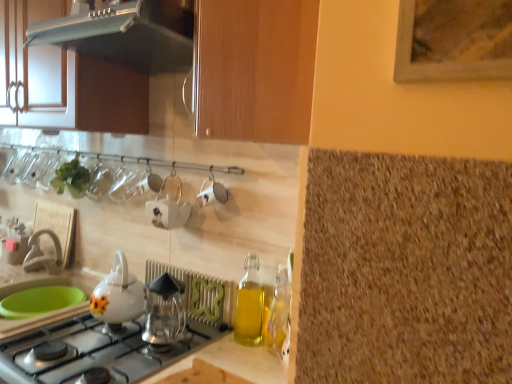
At what (x,y) coordinates should I click in order to perform the action: click on white glossy teapot at lower left, the second kitchen appliance viewed from the top. Please return your answer as a coordinate pair (x, y). Looking at the image, I should click on (117, 297).

Consider the image. Measure the distance between translucent glass bottle at right and camera.

1.17 meters.

Measure the distance between point (273, 320) and camera.

Point (273, 320) is 4.65 feet from camera.

Describe the element at coordinates (97, 352) in the screenshot. This screenshot has width=512, height=384. I see `white glossy gas stove at lower left` at that location.

The image size is (512, 384). What do you see at coordinates (211, 192) in the screenshot?
I see `white ceramic cup at center, the first tableware positioned from the front` at bounding box center [211, 192].

Find the location of a particular element. The height and width of the screenshot is (384, 512). clear glass vase at upper left, the second tableware viewed from the right is located at coordinates (48, 170).

At what (x,y) coordinates should I click in order to perform the action: click on white glossy teapot at lower left, which is the 2th kitchen appliance in bottom-to-top order. Please return your answer as a coordinate pair (x, y). This screenshot has height=384, width=512. Looking at the image, I should click on (117, 297).

Is white ceramic teapot at center oriented towards white glossy gas stove at lower left?

No, white ceramic teapot at center is not aimed at white glossy gas stove at lower left.

Consider the image. From the image's perspective, which object appears higher, white ceramic teapot at center or white glossy gas stove at lower left?

From the image's view, white ceramic teapot at center is above.

From a real-world perspective, who is located higher, white ceramic teapot at center or white glossy gas stove at lower left?

white ceramic teapot at center is physically above.

Between white ceramic teapot at center and white glossy gas stove at lower left, which one appears on the right side from the viewer's perspective?

white ceramic teapot at center.

Based on the photo, considering the relative sizes of clear glass vase at upper left, arranged as the 1th tableware when viewed from the back, and white ceramic teapot at center in the image provided, is clear glass vase at upper left, arranged as the 1th tableware when viewed from the back, thinner than white ceramic teapot at center?

Indeed, clear glass vase at upper left, arranged as the 1th tableware when viewed from the back, has a lesser width compared to white ceramic teapot at center.

Is clear glass vase at upper left, the second tableware viewed from the right, looking in the opposite direction of white ceramic teapot at center?

No, clear glass vase at upper left, the second tableware viewed from the right, is not facing away from white ceramic teapot at center.

Identify the location of appliance directly beneath the clear glass vase at upper left, arranged as the 1th tableware when viewed from the back (from a real-world perspective). (169, 205).

There is a white glossy teapot at lower left, which is the 2th kitchen appliance in bottom-to-top order. Where is `kitchen appliance above it (from a real-world perspective)`? Image resolution: width=512 pixels, height=384 pixels. kitchen appliance above it (from a real-world perspective) is located at coordinates (127, 34).

How different are the orientations of satin silver range hood at upper left, the third kitchen appliance in the bottom-to-top sequence, and white glossy teapot at lower left, the second kitchen appliance viewed from the top, in degrees?

There is a 0.186-degree angle between the facing directions of satin silver range hood at upper left, the third kitchen appliance in the bottom-to-top sequence, and white glossy teapot at lower left, the second kitchen appliance viewed from the top.

In the image, is satin silver range hood at upper left, the third kitchen appliance in the bottom-to-top sequence, on the left side or the right side of white glossy teapot at lower left, which is the 2th kitchen appliance in bottom-to-top order?

satin silver range hood at upper left, the third kitchen appliance in the bottom-to-top sequence, is positioned on white glossy teapot at lower left, which is the 2th kitchen appliance in bottom-to-top order,'s right side.

From the image's perspective, does satin silver range hood at upper left, which appears as the 1th kitchen appliance when viewed from the top, appear lower than white glossy teapot at lower left, which is the 2th kitchen appliance in bottom-to-top order?

No.

Is translucent glass bottle at right positioned with its back to satin silver range hood at upper left, the third kitchen appliance in the bottom-to-top sequence?

That's not correct — translucent glass bottle at right is not looking away from satin silver range hood at upper left, the third kitchen appliance in the bottom-to-top sequence.

Based on the photo, can you confirm if translucent glass bottle at right is smaller than satin silver range hood at upper left, which appears as the 1th kitchen appliance when viewed from the top?

Yes.

Is translucent glass bottle at right completely or partially outside of satin silver range hood at upper left, which appears as the 1th kitchen appliance when viewed from the top?

translucent glass bottle at right is positioned outside satin silver range hood at upper left, which appears as the 1th kitchen appliance when viewed from the top.

Does point (274, 309) come closer to viewer compared to point (175, 53)?

No, (274, 309) is behind (175, 53).

From a real-world perspective, is satin silver range hood at upper left, which appears as the 1th kitchen appliance when viewed from the top, positioned above or below clear glass vase at upper left, the 1th tableware positioned from the left?

In terms of real-world spatial position, satin silver range hood at upper left, which appears as the 1th kitchen appliance when viewed from the top, is above clear glass vase at upper left, the 1th tableware positioned from the left.

Considering the sizes of satin silver range hood at upper left, the third kitchen appliance in the bottom-to-top sequence, and clear glass vase at upper left, the 1th tableware positioned from the left, in the image, is satin silver range hood at upper left, the third kitchen appliance in the bottom-to-top sequence, taller or shorter than clear glass vase at upper left, the 1th tableware positioned from the left,?

satin silver range hood at upper left, the third kitchen appliance in the bottom-to-top sequence, is shorter than clear glass vase at upper left, the 1th tableware positioned from the left.

From the picture: From the image's perspective, would you say satin silver range hood at upper left, which appears as the 1th kitchen appliance when viewed from the top, is shown under clear glass vase at upper left, the 1th tableware positioned from the left?

Incorrect, from the image's perspective, satin silver range hood at upper left, which appears as the 1th kitchen appliance when viewed from the top, is higher than clear glass vase at upper left, the 1th tableware positioned from the left.

Can you tell me how much satin silver range hood at upper left, which appears as the 1th kitchen appliance when viewed from the top, and clear glass vase at upper left, arranged as the 1th tableware when viewed from the back, differ in facing direction?

The angular difference between satin silver range hood at upper left, which appears as the 1th kitchen appliance when viewed from the top, and clear glass vase at upper left, arranged as the 1th tableware when viewed from the back, is 1.76 degrees.

Is transparent glass coffee maker at center, the 3th kitchen appliance in the top-to-bottom sequence, thinner than clear glass vase at upper left, arranged as the 1th tableware when viewed from the back?

Incorrect, the width of transparent glass coffee maker at center, the 3th kitchen appliance in the top-to-bottom sequence, is not less than that of clear glass vase at upper left, arranged as the 1th tableware when viewed from the back.

Does point (155, 325) come closer to viewer compared to point (42, 178)?

That is True.

Who is smaller, transparent glass coffee maker at center, the 3th kitchen appliance in the top-to-bottom sequence, or clear glass vase at upper left, the 1th tableware positioned from the left?

clear glass vase at upper left, the 1th tableware positioned from the left.

From a real-world perspective, which object stands above the other?

clear glass vase at upper left, the second tableware in the front-to-back sequence, from a real-world perspective.

From the image's perspective, between satin silver range hood at upper left, the third kitchen appliance in the bottom-to-top sequence, and matte wood cabinet at upper left, which one is located above?

From the image's view, matte wood cabinet at upper left is above.

Is satin silver range hood at upper left, the third kitchen appliance in the bottom-to-top sequence, not close to matte wood cabinet at upper left?

No, satin silver range hood at upper left, the third kitchen appliance in the bottom-to-top sequence, is not far away from matte wood cabinet at upper left.

Considering the relative sizes of satin silver range hood at upper left, which appears as the 1th kitchen appliance when viewed from the top, and matte wood cabinet at upper left in the image provided, is satin silver range hood at upper left, which appears as the 1th kitchen appliance when viewed from the top, wider than matte wood cabinet at upper left?

Indeed, satin silver range hood at upper left, which appears as the 1th kitchen appliance when viewed from the top, has a greater width compared to matte wood cabinet at upper left.

The width and height of the screenshot is (512, 384). Identify the location of gas stove on the left of the white ceramic teapot at center. (97, 352).

From a real-world perspective, starting from the white ceramic teapot at center, which tableware is the 1st one vertically above it? Please provide its 2D coordinates.

[(48, 170)]

Estimate the real-world distances between objects in this image. Which object is further from white ceramic teapot at center, transparent glass coffee maker at center, the first kitchen appliance when ordered from bottom to top, or white glossy teapot at lower left, which is the 2th kitchen appliance in bottom-to-top order?

transparent glass coffee maker at center, the first kitchen appliance when ordered from bottom to top, lies further to white ceramic teapot at center than the other object.

Considering their positions, is clear glass vase at upper left, the second tableware in the front-to-back sequence, positioned closer to white glossy gas stove at lower left than white ceramic teapot at center?

white ceramic teapot at center.

Considering their positions, is translucent glass bottle at right positioned closer to transparent glass coffee maker at center, the 3th kitchen appliance in the top-to-bottom sequence, than white ceramic teapot at center?

white ceramic teapot at center.

From the image, which object appears to be farther from white ceramic teapot at center, white glossy gas stove at lower left or white glossy teapot at lower left, which is the 2th kitchen appliance in bottom-to-top order?

Among the two, white glossy gas stove at lower left is located further to white ceramic teapot at center.

From the image, which object appears to be nearer to matte wood cabinet at upper left, white ceramic teapot at center or transparent glass coffee maker at center, the first kitchen appliance when ordered from bottom to top?

white ceramic teapot at center is closer to matte wood cabinet at upper left.

Looking at the image, which one is located further to transparent glass coffee maker at center, the first kitchen appliance when ordered from bottom to top, white ceramic cup at center, which appears as the second tableware when viewed from the back, or clear glass vase at upper left, the second tableware in the front-to-back sequence?

clear glass vase at upper left, the second tableware in the front-to-back sequence, lies further to transparent glass coffee maker at center, the first kitchen appliance when ordered from bottom to top, than the other object.

Considering their positions, is clear glass vase at upper left, the second tableware in the front-to-back sequence, positioned closer to white ceramic cup at center, the first tableware positioned from the front, than satin silver range hood at upper left, which appears as the 1th kitchen appliance when viewed from the top?

Based on the image, satin silver range hood at upper left, which appears as the 1th kitchen appliance when viewed from the top, appears to be nearer to white ceramic cup at center, the first tableware positioned from the front.

Looking at the image, which one is located closer to white glossy teapot at lower left, which is the 2th kitchen appliance in bottom-to-top order, matte white faucet at lower left or matte wood cabinet at upper left?

matte wood cabinet at upper left is closer to white glossy teapot at lower left, which is the 2th kitchen appliance in bottom-to-top order.

Identify the location of tableware located between matte white faucet at lower left and translucent glass bottle at right in the left-right direction. The width and height of the screenshot is (512, 384). point(211,192).

This screenshot has height=384, width=512. Find the location of `tap between satin silver range hood at upper left, the third kitchen appliance in the bottom-to-top sequence, and clear glass vase at upper left, the second tableware viewed from the right, from front to back`. tap between satin silver range hood at upper left, the third kitchen appliance in the bottom-to-top sequence, and clear glass vase at upper left, the second tableware viewed from the right, from front to back is located at coordinates (42, 254).

Locate an element on the screen. appliance between clear glass vase at upper left, arranged as the 1th tableware when viewed from the back, and translucent glass bottle at right from left to right is located at coordinates (169, 205).

In order to click on appliance between white glossy teapot at lower left, which is the 2th kitchen appliance in bottom-to-top order, and translucent glass bottle at right from left to right in this screenshot , I will do `click(169, 205)`.